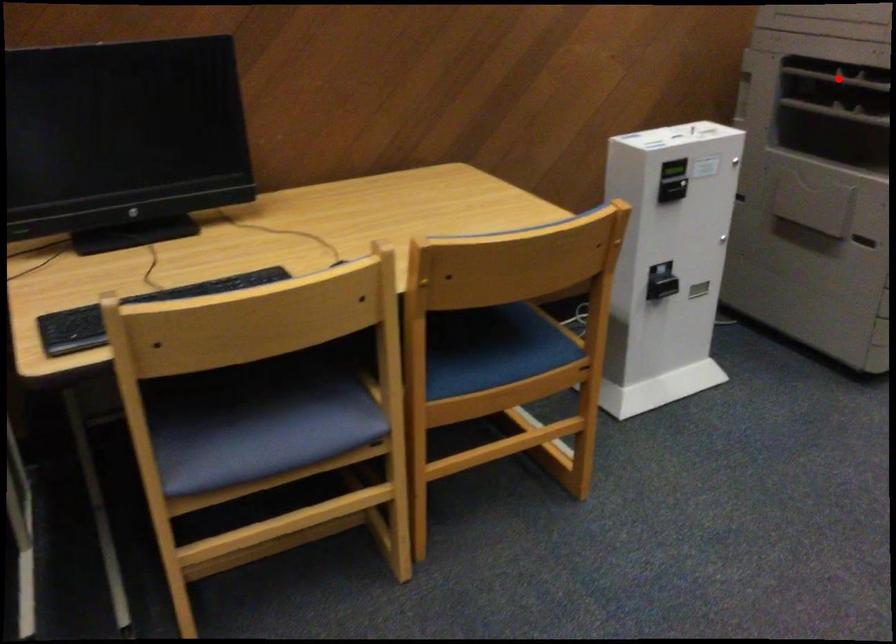
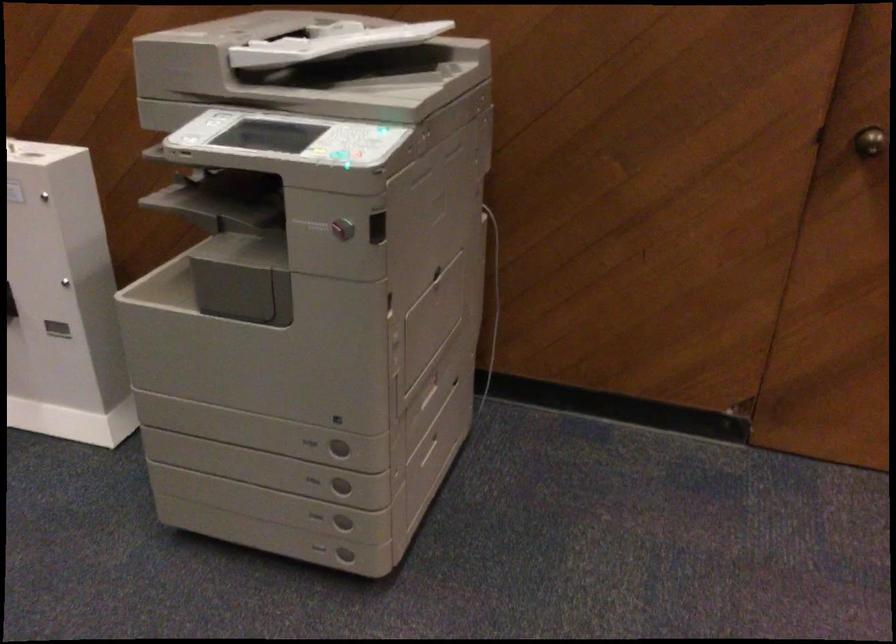
Question: I am providing you with two images of the same scene from different viewpoints. A red point is marked on the first image. Is the red point's position out of view in image 2?

Choices:
 (A) Yes
 (B) No

Answer: (A)